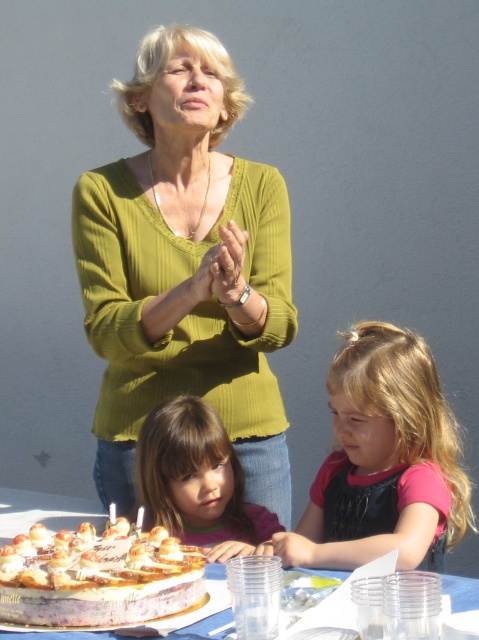
Does matte pink shirt at lower center appear on the right side of golden glaze cake at lower left?

Indeed, matte pink shirt at lower center is positioned on the right side of golden glaze cake at lower left.

Which is behind, point (445, 483) or point (4, 616)?

The point (445, 483) is behind.

Image resolution: width=479 pixels, height=640 pixels. I want to click on matte pink shirt at lower center, so click(x=384, y=460).

Is green ribbed sweater at center wider than golden glaze cake at lower left?

Indeed, green ribbed sweater at center has a greater width compared to golden glaze cake at lower left.

Is point (200, 252) positioned in front of point (11, 621)?

No, (200, 252) is behind (11, 621).

At what (x,y) coordinates should I click in order to perform the action: click on green ribbed sweater at center. Please return your answer as a coordinate pair (x, y). This screenshot has width=479, height=640. Looking at the image, I should click on point(185,268).

Can you confirm if golden glaze cake at lower left is bigger than brown matte hair at center?

Incorrect, golden glaze cake at lower left is not larger than brown matte hair at center.

Who is positioned more to the right, golden glaze cake at lower left or brown matte hair at center?

Positioned to the right is brown matte hair at center.

Does point (125, 568) come behind point (167, 490)?

No, it is not.

Where is `golden glaze cake at lower left`? The height and width of the screenshot is (640, 479). golden glaze cake at lower left is located at coordinates (98, 579).